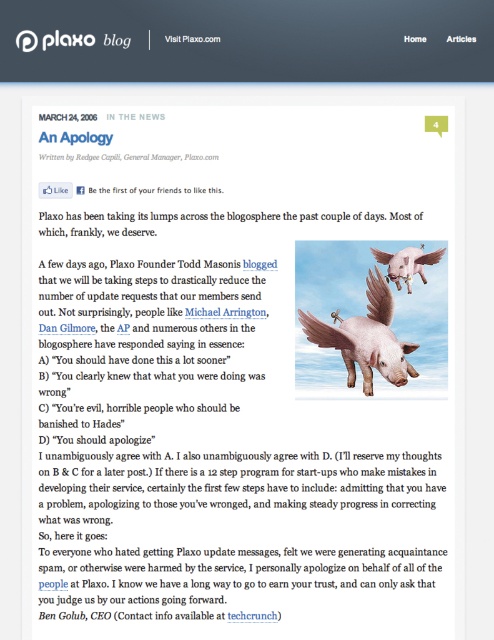
Question: Which of the following is the closest to the observer?

Choices:
 (A) black text at bottom right
 (B) matte pink pig at center
 (C) pink feathered pig at upper right

Answer: (A)

Question: Does matte pink pig at center come in front of pink feathered pig at upper right?

Choices:
 (A) yes
 (B) no

Answer: (A)

Question: Estimate the real-world distances between objects in this image. Which object is closer to the pink feathered pig at upper right?

Choices:
 (A) black text at bottom right
 (B) matte pink pig at center

Answer: (B)

Question: Which point appears closest to the camera in this image?

Choices:
 (A) (422, 252)
 (B) (271, 614)
 (C) (369, 269)

Answer: (B)

Question: Does matte pink pig at center come in front of pink feathered pig at upper right?

Choices:
 (A) yes
 (B) no

Answer: (A)

Question: Does matte pink pig at center have a greater width compared to black text at bottom right?

Choices:
 (A) yes
 (B) no

Answer: (A)